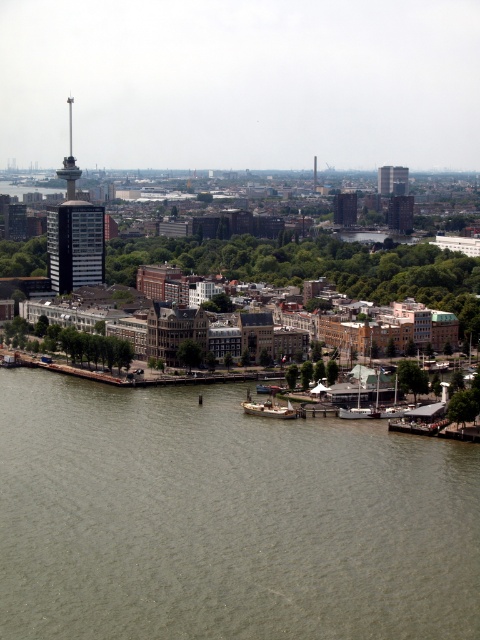
You are standing at the waterfront in the cityscape image. There is a point marked at coordinates point (72,406). Can you walk to that point from your current position?

The point (72,406) is 554.35 meters away from viewer, so yes, you can walk to that point from your current position as it is within a reasonable walking distance.